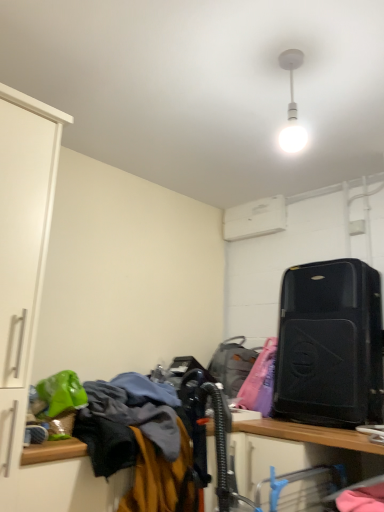
Question: Is point (233, 375) positioned closer to the camera than point (301, 404)?

Choices:
 (A) closer
 (B) farther

Answer: (B)

Question: From the image's perspective, is matte black suitcase at center right positioned above or below black matte suitcase at right?

Choices:
 (A) above
 (B) below

Answer: (B)

Question: Considering the real-world distances, which object is farthest from the matte black suitcase at center right?

Choices:
 (A) black matte suitcase at right
 (B) metallic silver computer desk at lower center
 (C) white matte light bulb at upper center
 (D) textured fabric laundry at lower left
 (E) white plastic air conditioner at upper center

Answer: (C)

Question: Estimate the real-world distances between objects in this image. Which object is closer to the textured fabric laundry at lower left?

Choices:
 (A) white matte light bulb at upper center
 (B) matte black suitcase at center right
 (C) wooden desk at lower center
 (D) metallic silver computer desk at lower center
 (E) black matte suitcase at right

Answer: (B)